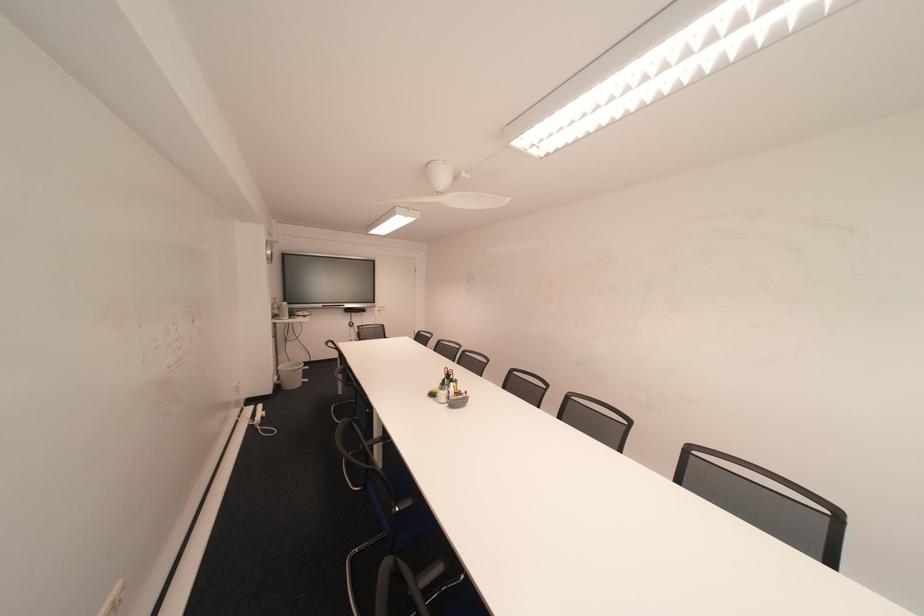
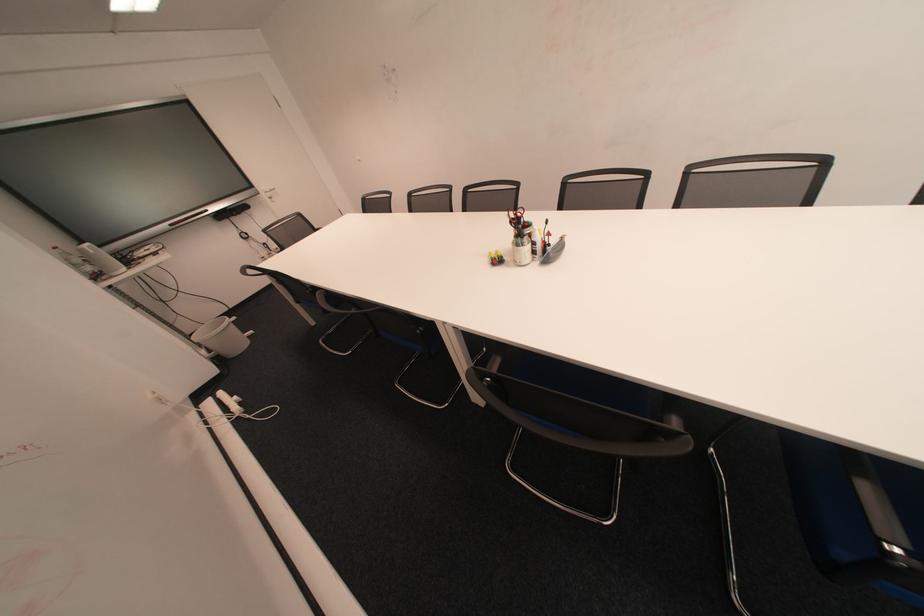
Find the pixel in the second image that matches [288,371] in the first image.

(209, 345)